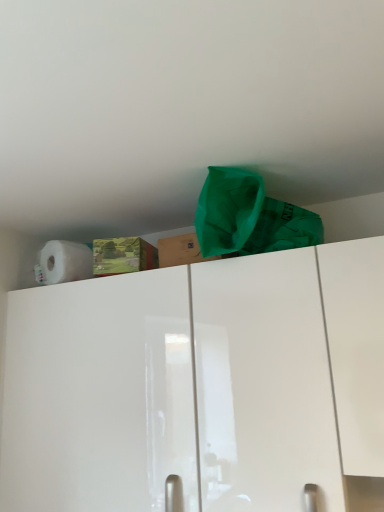
Question: Considering the relative sizes of brown cardboard box at upper center and white matte paper towel at upper left in the image provided, is brown cardboard box at upper center smaller than white matte paper towel at upper left?

Choices:
 (A) yes
 (B) no

Answer: (A)

Question: Does brown cardboard box at upper center have a larger size compared to white matte paper towel at upper left?

Choices:
 (A) no
 (B) yes

Answer: (A)

Question: From the image's perspective, does brown cardboard box at upper center appear higher than white matte paper towel at upper left?

Choices:
 (A) no
 (B) yes

Answer: (B)

Question: Considering the relative positions of brown cardboard box at upper center and white matte paper towel at upper left in the image provided, is brown cardboard box at upper center to the right of white matte paper towel at upper left from the viewer's perspective?

Choices:
 (A) no
 (B) yes

Answer: (B)

Question: From a real-world perspective, is brown cardboard box at upper center physically above white matte paper towel at upper left?

Choices:
 (A) yes
 (B) no

Answer: (B)

Question: Is green fabric bag at upper center wider or thinner than brown cardboard box at upper center?

Choices:
 (A) thin
 (B) wide

Answer: (B)

Question: From a real-world perspective, is green fabric bag at upper center positioned above or below brown cardboard box at upper center?

Choices:
 (A) below
 (B) above

Answer: (B)

Question: Is green fabric bag at upper center inside the boundaries of brown cardboard box at upper center, or outside?

Choices:
 (A) outside
 (B) inside

Answer: (A)

Question: Is green fabric bag at upper center to the left or to the right of brown cardboard box at upper center in the image?

Choices:
 (A) right
 (B) left

Answer: (A)

Question: From a real-world perspective, is brown cardboard box at upper center physically located above or below white glossy cabinet at upper center?

Choices:
 (A) below
 (B) above

Answer: (B)

Question: Is brown cardboard box at upper center to the left or to the right of white glossy cabinet at upper center in the image?

Choices:
 (A) right
 (B) left

Answer: (A)

Question: In terms of size, does brown cardboard box at upper center appear bigger or smaller than white glossy cabinet at upper center?

Choices:
 (A) small
 (B) big

Answer: (A)

Question: Considering the positions of brown cardboard box at upper center and white glossy cabinet at upper center in the image, is brown cardboard box at upper center taller or shorter than white glossy cabinet at upper center?

Choices:
 (A) tall
 (B) short

Answer: (B)

Question: Is white glossy cabinet at upper center wider or thinner than green fabric bag at upper center?

Choices:
 (A) wide
 (B) thin

Answer: (A)

Question: Is white glossy cabinet at upper center situated inside green fabric bag at upper center or outside?

Choices:
 (A) inside
 (B) outside

Answer: (B)